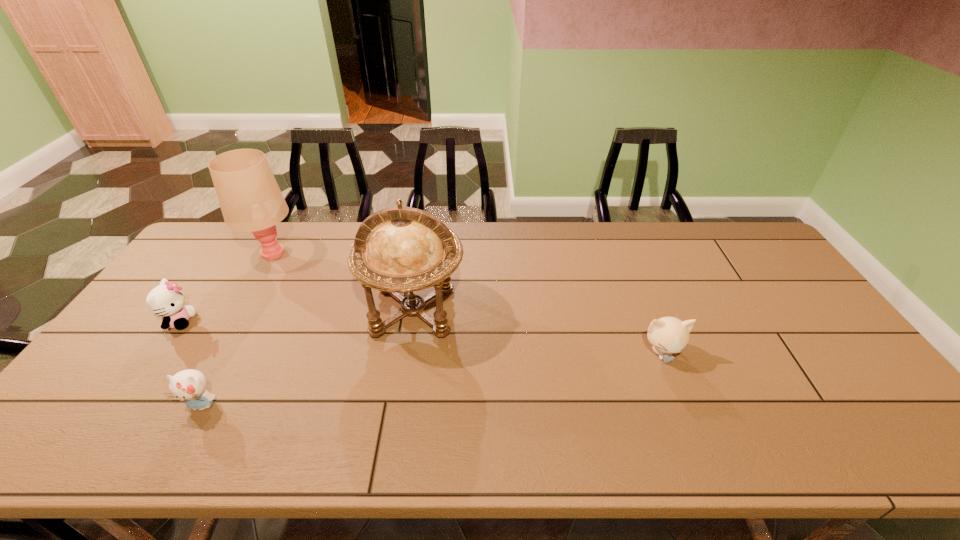
At what (x,y) coordinates should I click in order to perform the action: click on free space located 0.380m on the front-facing side of the leftmost object. Please return your answer as a coordinate pair (x, y). This screenshot has width=960, height=540. Looking at the image, I should click on coord(327,321).

Where is `vacant area situated on the face of the rightmost object`? vacant area situated on the face of the rightmost object is located at coordinates (701, 452).

Image resolution: width=960 pixels, height=540 pixels. What are the coordinates of `free space located 0.080m on the front-facing side of the second kitten from left to right` in the screenshot? It's located at (177, 451).

The height and width of the screenshot is (540, 960). In order to click on object at the far edge in this screenshot , I will do `click(250, 199)`.

Where is `object situated at the left edge`? The image size is (960, 540). object situated at the left edge is located at coordinates (166, 300).

In the image, there is a desktop. Identify the location of vacant region at the near edge. This screenshot has height=540, width=960. (694, 424).

In order to click on vacant region at the left edge of the desktop in this screenshot , I will do `click(164, 347)`.

In order to click on free location at the far left corner in this screenshot , I will do tap(224, 229).

This screenshot has height=540, width=960. In the image, there is a desktop. Identify the location of free region at the far right corner. (725, 236).

At what (x,y) coordinates should I click in order to perform the action: click on vacant space in between the second kitten from right to left and the fourth object from left to right. Please return your answer as a coordinate pair (x, y). The image size is (960, 540). Looking at the image, I should click on (307, 358).